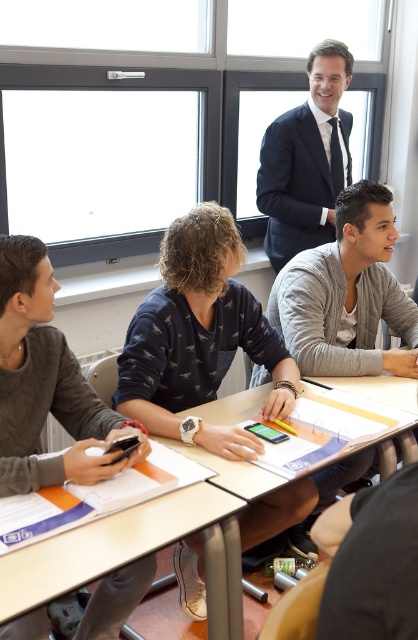
Question: Does dark blue suit at upper center appear over wooden table at center?

Choices:
 (A) yes
 (B) no

Answer: (A)

Question: Does dark blue sweater at center appear on the right side of wooden desk at center?

Choices:
 (A) no
 (B) yes

Answer: (B)

Question: Which point appears closest to the camera in this image?

Choices:
 (A) (101, 536)
 (B) (229, 465)
 (C) (321, 93)

Answer: (A)

Question: Can you confirm if dark blue sweater at center is positioned above wooden desk at center?

Choices:
 (A) no
 (B) yes

Answer: (B)

Question: Estimate the real-world distances between objects in this image. Which object is farther from the wooden table at center?

Choices:
 (A) wooden desk at center
 (B) dark blue suit at upper center
 (C) dark blue sweater at center

Answer: (B)

Question: Which point is farther from the camera taking this photo?

Choices:
 (A) (328, 52)
 (B) (193, 252)
 (C) (186, 506)

Answer: (A)